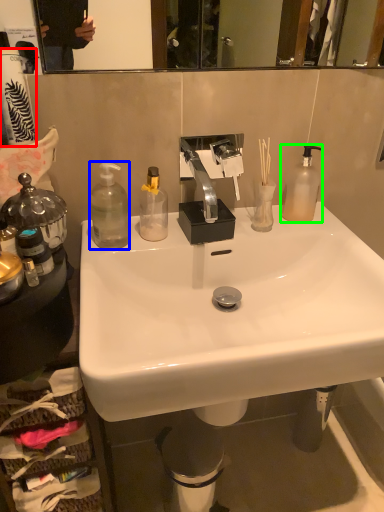
Question: Estimate the real-world distances between objects in this image. Which object is farther from toilet paper (highlighted by a red box), bottle (highlighted by a blue box) or bottle (highlighted by a green box)?

Choices:
 (A) bottle
 (B) bottle

Answer: (B)